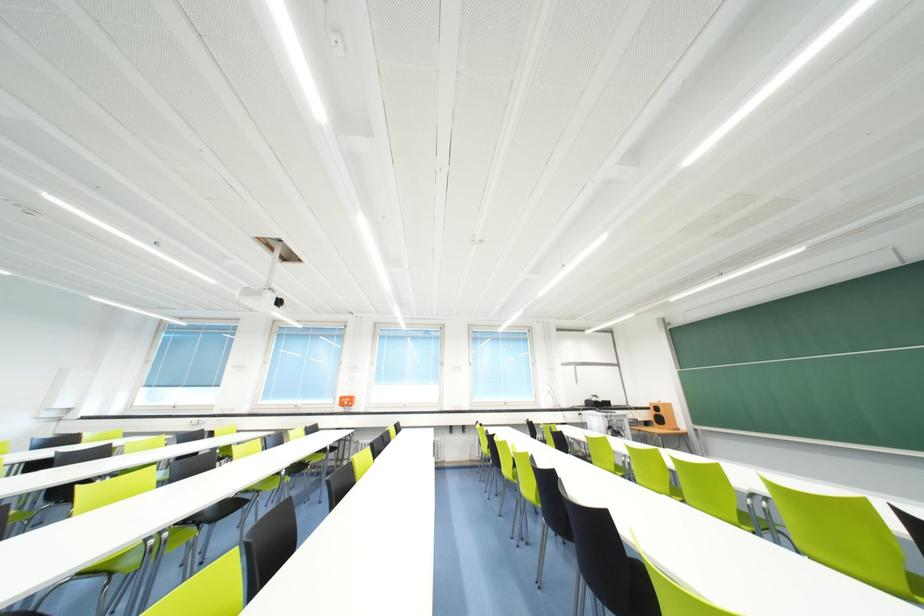
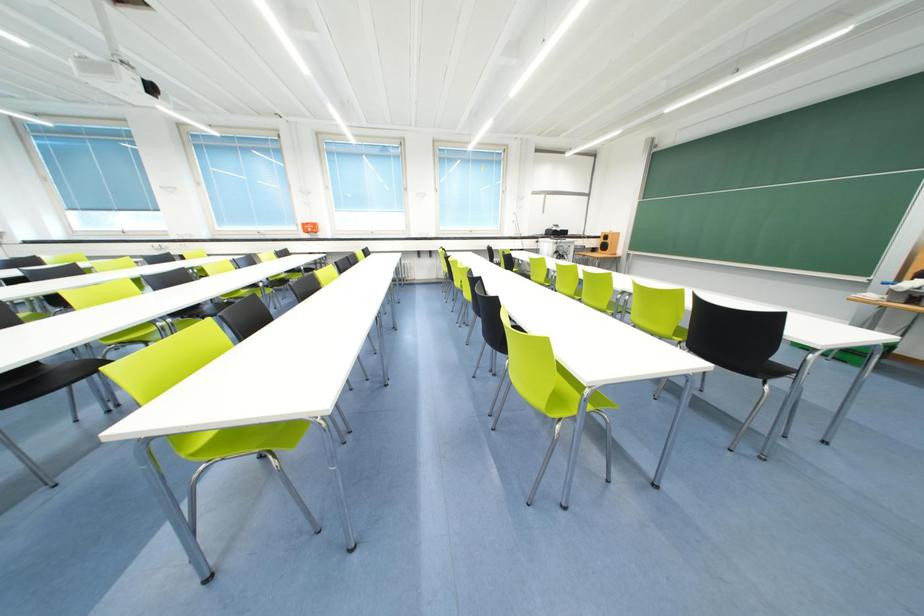
Question: The first image is from the beginning of the video and the second image is from the end. How did the camera likely rotate when shooting the video?

Choices:
 (A) Left
 (B) Right
 (C) Up
 (D) Down

Answer: (D)